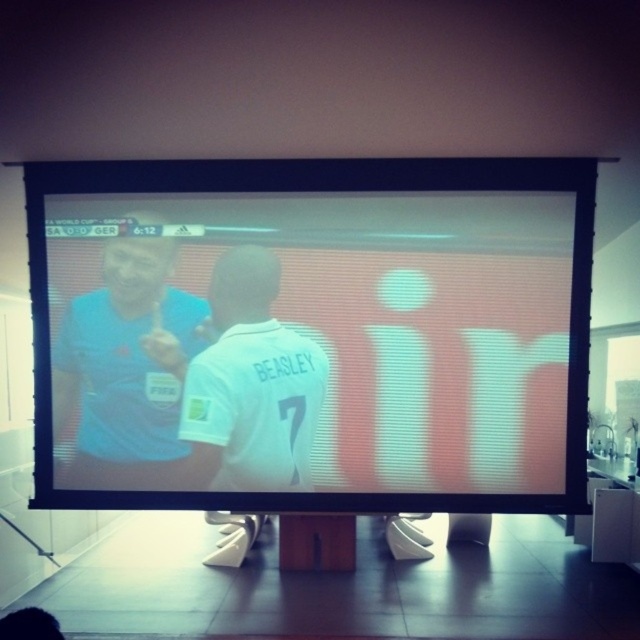
Question: Is matte blue shirt at upper left below white jersey at center?

Choices:
 (A) no
 (B) yes

Answer: (A)

Question: In this image, where is matte black monitor at center located relative to white jersey at center?

Choices:
 (A) right
 (B) left

Answer: (A)

Question: Estimate the real-world distances between objects in this image. Which object is farther from the matte blue shirt at upper left?

Choices:
 (A) white jersey at center
 (B) matte black monitor at center

Answer: (B)

Question: Which is nearer to the matte blue shirt at upper left?

Choices:
 (A) matte black monitor at center
 (B) white jersey at center

Answer: (B)

Question: Does matte black monitor at center appear on the right side of white jersey at center?

Choices:
 (A) yes
 (B) no

Answer: (A)

Question: Which is farther from the white jersey at center?

Choices:
 (A) matte blue shirt at upper left
 (B) matte black monitor at center

Answer: (A)